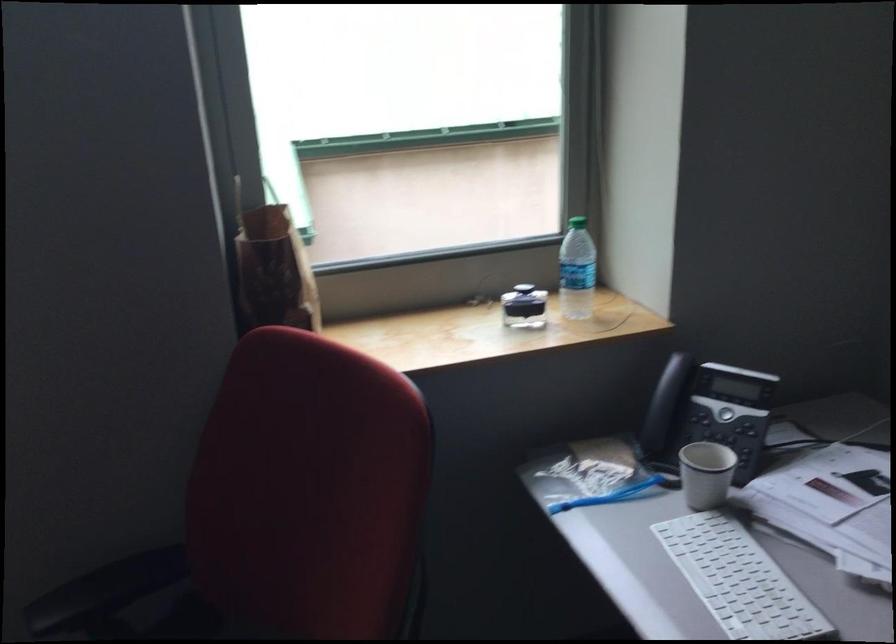
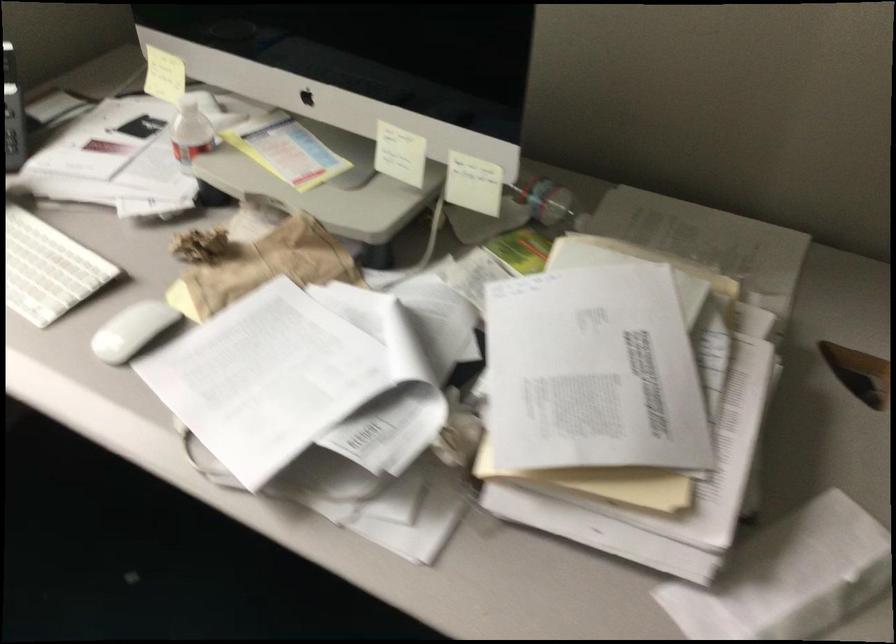
How did the camera likely rotate?

The camera's rotation is toward right-down.